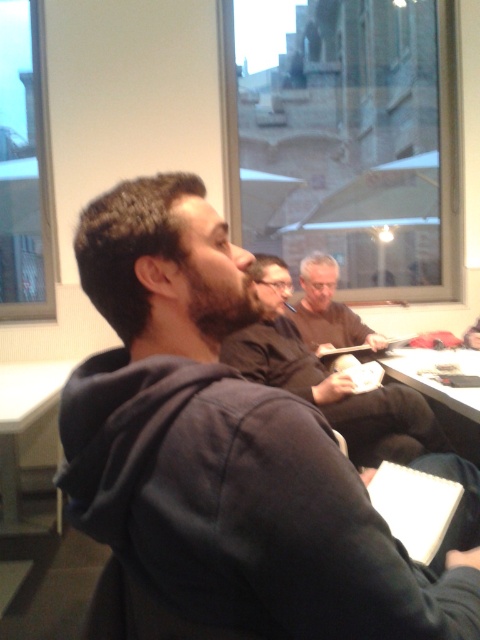
You are organizing a photo shoot and need to ensure that the dark brown leather jacket at center and the gray hair man at center are both visible in the frame. Given their sizes, which object should be placed closer to the camera to maintain their visibility?

The dark brown leather jacket at center is larger in size compared to the gray hair man at center. To maintain visibility, the gray hair man at center should be placed closer to the camera since smaller objects need to be nearer to appear prominent in the frame.

You are sitting at the table and see the dark brown leather jacket at center and the gray hair man at center. Which one is positioned to the left?

The dark brown leather jacket at center is to the left of the gray hair man at center.

You are organizing a photo shoot and need to ensure that the black hoodie at center and the white paper at center are visible in the frame. Based on their sizes, which object should you prioritize positioning closer to the camera to maintain clarity?

The black hoodie at center is taller than the white paper at center, so you should prioritize positioning the white paper at center closer to the camera to ensure both are clearly visible.